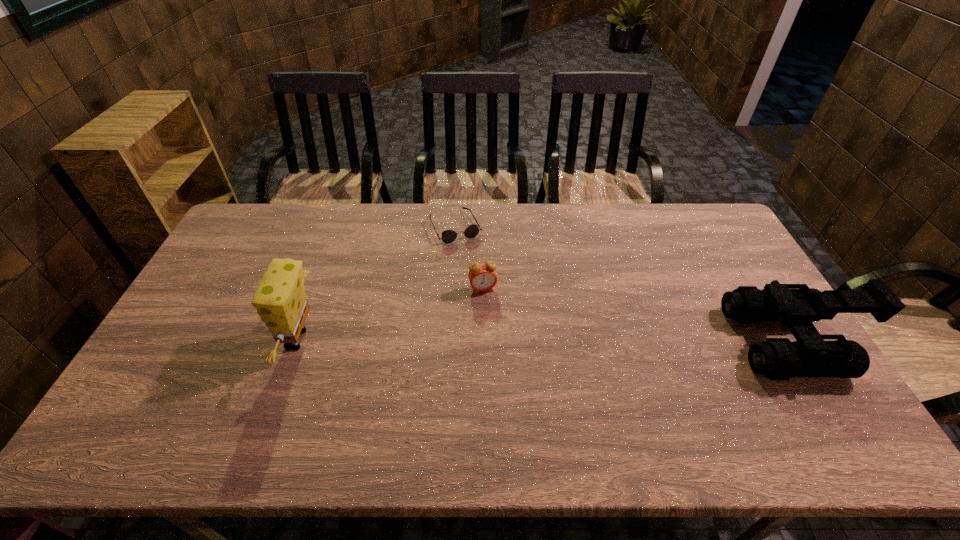
Locate an element on the screen. Image resolution: width=960 pixels, height=540 pixels. the second closest object to the shortest object is located at coordinates (280, 300).

Identify the location of object that is the second closest one to the third tallest object. (280, 300).